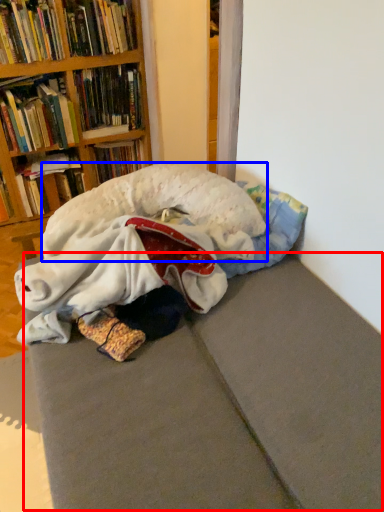
Question: Which of the following is the closest to the observer, bed frame (highlighted by a red box) or animal (highlighted by a blue box)?

Choices:
 (A) bed frame
 (B) animal

Answer: (A)